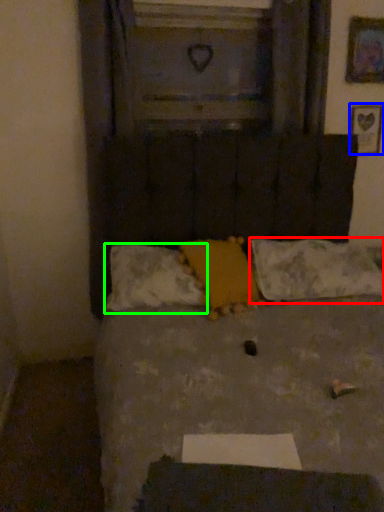
Question: Estimate the real-world distances between objects in this image. Which object is closer to pillow (highlighted by a red box), picture frame (highlighted by a blue box) or pillow (highlighted by a green box)?

Choices:
 (A) picture frame
 (B) pillow

Answer: (B)